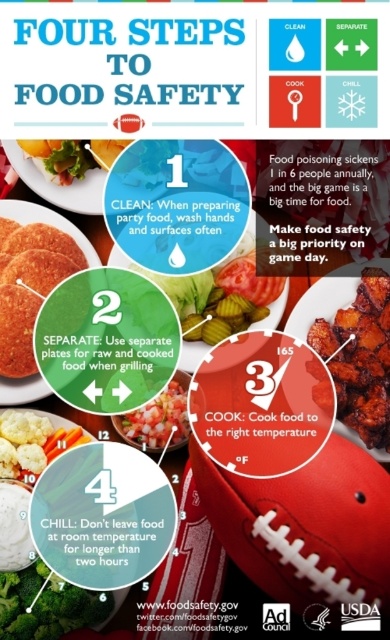
You are arranging food on a table for a party. You have a green leafy broccoli at lower left and a matte plastic plate at upper left. How far apart are they?

The green leafy broccoli at lower left is 32.67 inches away from the matte plastic plate at upper left.

You are arranging appetizers on a table and see the charred crispy chicken at center and the matte plastic plate at upper left. Which item is closer to you?

The charred crispy chicken at center is closer to you because it is in front of the matte plastic plate at upper left.

You are organizing a football game party and have both the matte brown football at center and the charred crispy chicken at center on the same table. According to the infographic, why should you avoid placing these two items in direct contact with each other?

The matte brown football at center is larger than the charred crispy chicken at center, so placing them in direct contact could cause the chicken to become contaminated from the football.